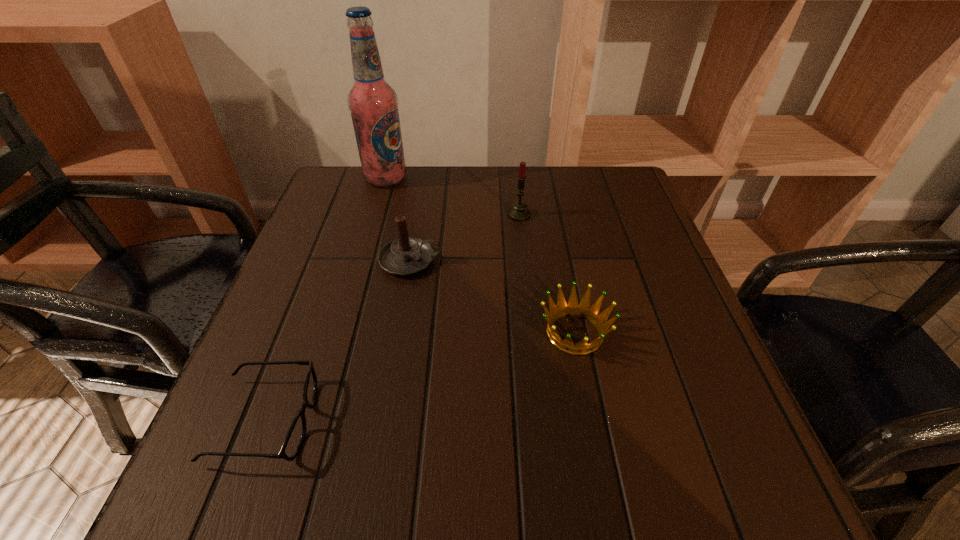
Find the location of a particular element. The height and width of the screenshot is (540, 960). free location that satisfies the following two spatial constraints: 1. on the front side of the crown; 2. on the front-facing side of the spectacles is located at coordinates (592, 421).

Where is `vacant region that satisfies the following two spatial constraints: 1. on the front side of the fourth tallest object; 2. on the front-facing side of the spectacles`? The image size is (960, 540). vacant region that satisfies the following two spatial constraints: 1. on the front side of the fourth tallest object; 2. on the front-facing side of the spectacles is located at coordinates (592, 421).